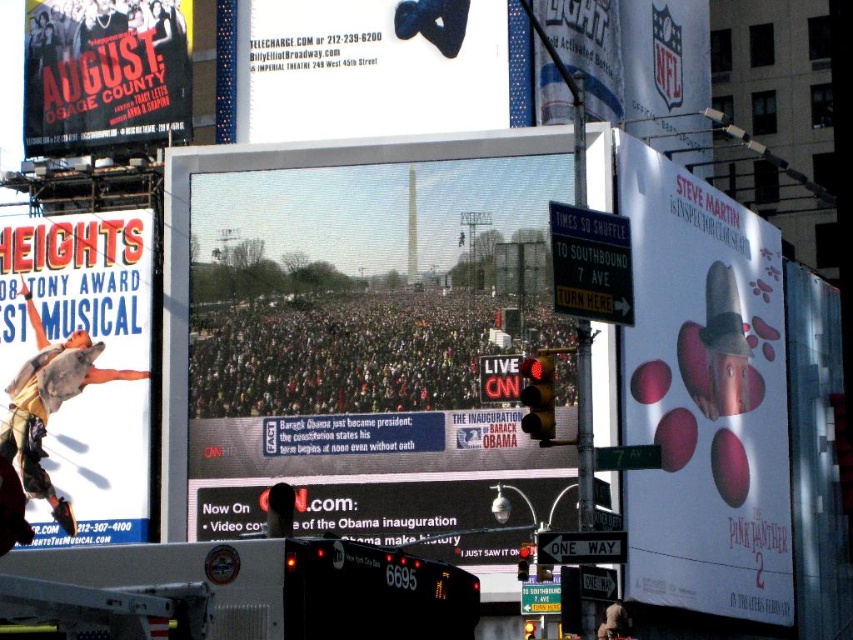
Between dark gray crowd at center and white plastic sign at center, which one is positioned higher?

dark gray crowd at center

Can you confirm if dark gray crowd at center is smaller than white plastic sign at center?

Actually, dark gray crowd at center might be larger than white plastic sign at center.

This screenshot has width=853, height=640. Identify the location of dark gray crowd at center. pyautogui.click(x=341, y=355).

Which is more to the left, matte digital display at center or white plastic sign at center?

From the viewer's perspective, matte digital display at center appears more on the left side.

Is matte digital display at center below white plastic sign at center?

No.

Which is in front, point (427, 298) or point (573, 540)?

Positioned in front is point (573, 540).

The image size is (853, 640). Find the location of `matte digital display at center`. matte digital display at center is located at coordinates (351, 328).

Between point (94, 230) and point (577, 548), which one is positioned behind?

The point (94, 230) is more distant.

You are a GUI agent. You are given a task and a screenshot of the screen. Output one action in this format:
    pyautogui.click(x=<x>, y=<y>)
    Task: Click on the orange fabric dancer at left
    This screenshot has height=640, width=853.
    Given the screenshot: What is the action you would take?
    pyautogui.click(x=80, y=364)